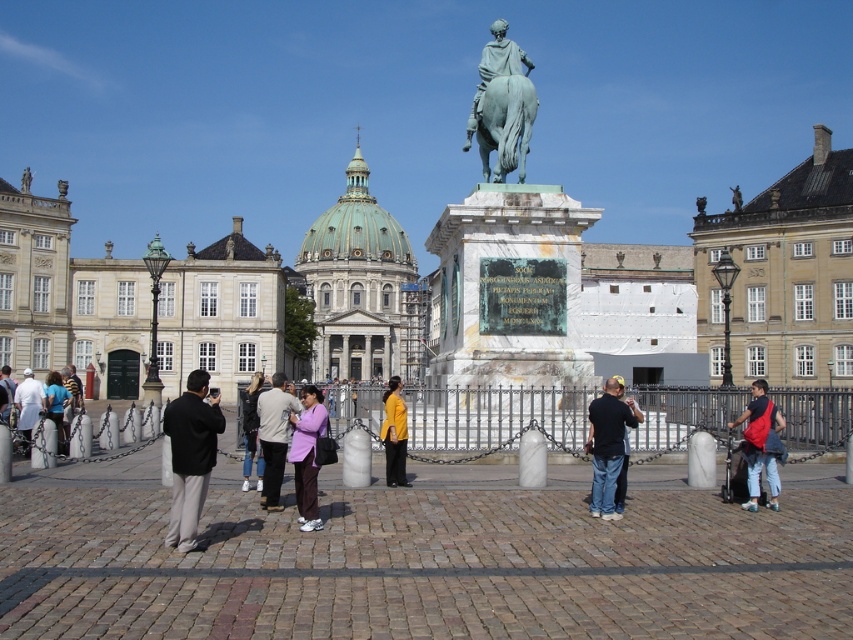
Is the position of yellow matte shirt at center more distant than that of light purple fabric shirt at center?

No, yellow matte shirt at center is closer to the viewer.

You are a GUI agent. You are given a task and a screenshot of the screen. Output one action in this format:
    pyautogui.click(x=<x>, y=<y>)
    Task: Click on the yellow matte shirt at center
    
    Given the screenshot: What is the action you would take?
    pyautogui.click(x=393, y=433)

Does point (398, 467) come closer to viewer compared to point (70, 394)?

Yes, it is in front of point (70, 394).

Where is `yellow matte shirt at center`? Image resolution: width=853 pixels, height=640 pixels. yellow matte shirt at center is located at coordinates (393, 433).

Is green marble dome at center below light purple fabric shirt at center?

Incorrect, green marble dome at center is not positioned below light purple fabric shirt at center.

Is the position of green marble dome at center more distant than that of light purple fabric shirt at center?

That is True.

Image resolution: width=853 pixels, height=640 pixels. I want to click on green marble dome at center, so click(360, 285).

Which of these two, green marble dome at center or purple fabric pants at center, stands taller?

Standing taller between the two is green marble dome at center.

Which is in front, point (331, 264) or point (299, 477)?

Point (299, 477)

The height and width of the screenshot is (640, 853). In order to click on green marble dome at center in this screenshot , I will do `click(360, 285)`.